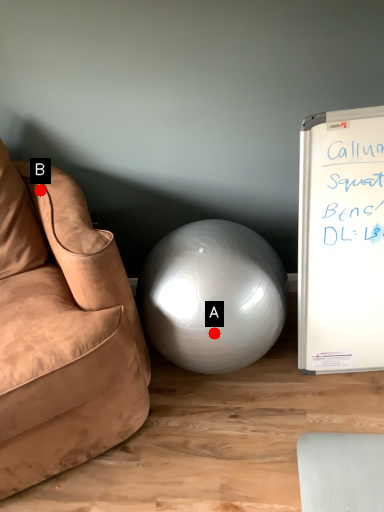
Question: Two points are circled on the image, labeled by A and B beside each circle. Which point is closer to the camera?

Choices:
 (A) A is closer
 (B) B is closer

Answer: (A)